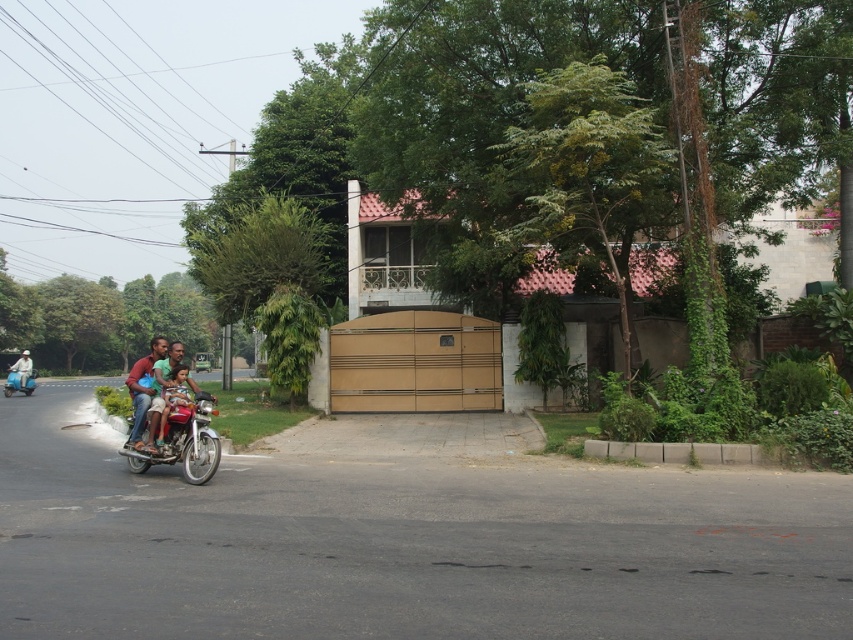
Question: Where is metallic red motorcycle at center-left located in relation to matte red motorcycle at center in the image?

Choices:
 (A) above
 (B) below

Answer: (B)

Question: Which of the following is the farthest from the observer?

Choices:
 (A) (160, 451)
 (B) (27, 376)

Answer: (B)

Question: Which object is closer to the camera taking this photo?

Choices:
 (A) blue glossy scooter at left
 (B) metallic red motorcycle at center-left

Answer: (B)

Question: Based on their relative distances, which object is nearer to the metallic red motorcycle at center-left?

Choices:
 (A) matte red motorcycle at center
 (B) matte red shirt at left
 (C) blue glossy scooter at left

Answer: (A)

Question: Is metallic red motorcycle at center-left positioned behind matte red motorcycle at center?

Choices:
 (A) no
 (B) yes

Answer: (A)

Question: Can you confirm if metallic red motorcycle at center-left is positioned to the left of blue glossy scooter at left?

Choices:
 (A) no
 (B) yes

Answer: (A)